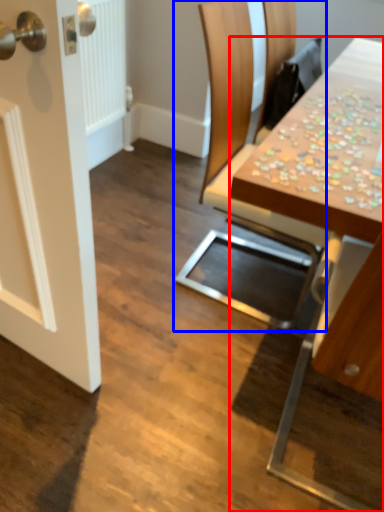
Question: Which object appears closest to the camera in this image, table (highlighted by a red box) or chair (highlighted by a blue box)?

Choices:
 (A) table
 (B) chair

Answer: (A)